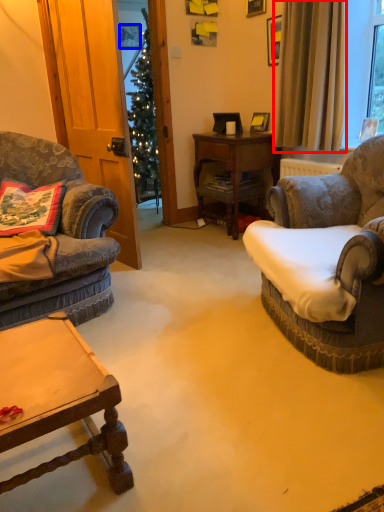
Question: Which point is closer to the camera, curtain (highlighted by a red box) or picture frame (highlighted by a blue box)?

Choices:
 (A) curtain
 (B) picture frame

Answer: (A)